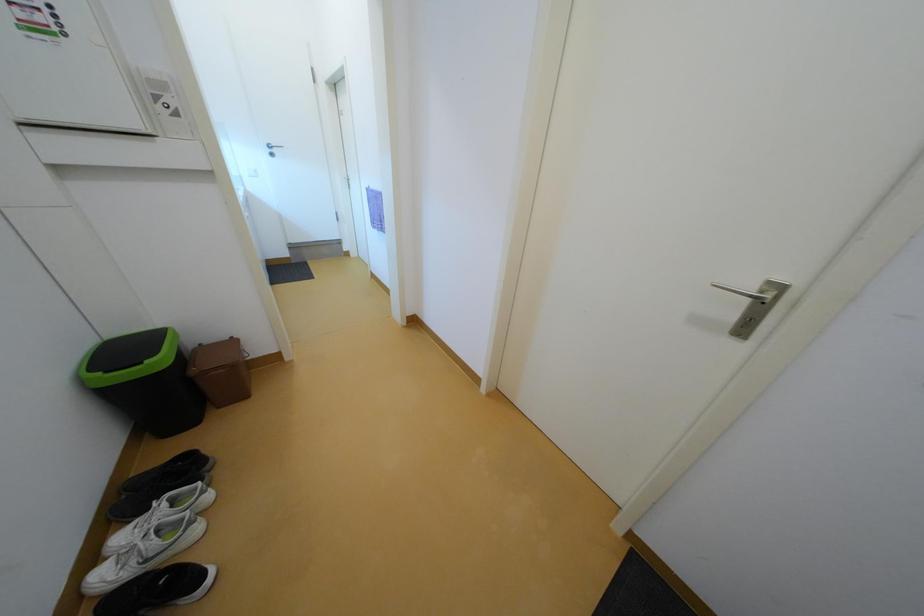
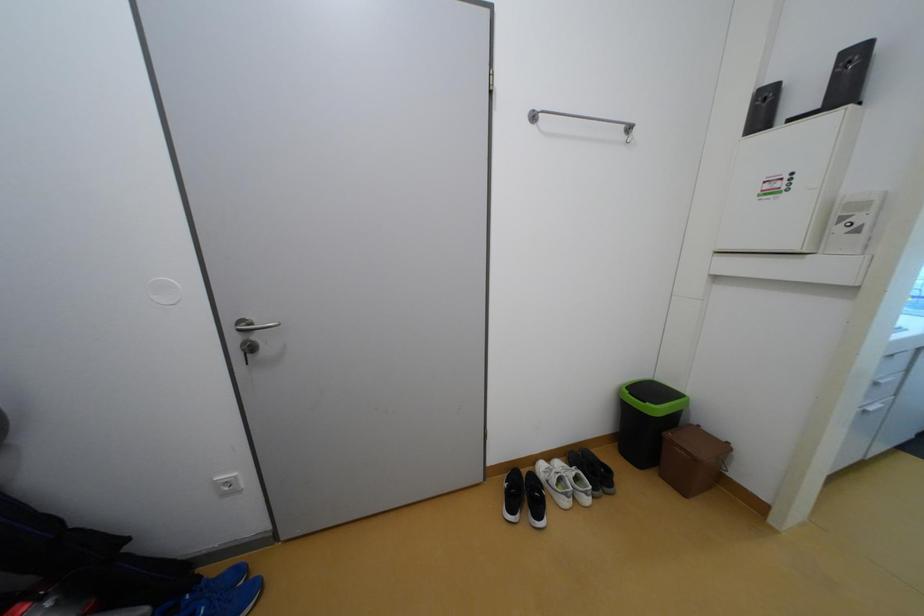
The images are taken continuously from a first-person perspective. In which direction is your viewpoint rotating?

The rotation direction of the camera is left-down.